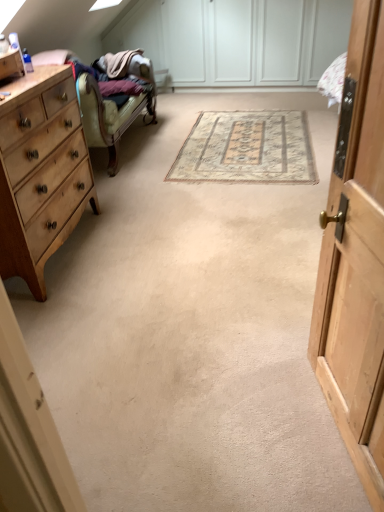
What do you see at coordinates (247, 149) in the screenshot? The height and width of the screenshot is (512, 384). I see `beige woven rug at center` at bounding box center [247, 149].

Locate an element on the screen. This screenshot has width=384, height=512. wooden cabinet at right is located at coordinates (356, 259).

Measure the distance between wooden cabinet at right and light wood/finish chest of drawers at left.

wooden cabinet at right and light wood/finish chest of drawers at left are 4.91 feet apart.

From a real-world perspective, who is located lower, wooden cabinet at right or light wood/finish chest of drawers at left?

light wood/finish chest of drawers at left is physically lower.

From the image's perspective, which one is positioned lower, wooden cabinet at right or light wood/finish chest of drawers at left?

wooden cabinet at right appears lower in the image.

How different are the orientations of wooden cabinet at right and light wood/finish chest of drawers at left in degrees?

They differ by 169 degrees in their facing directions.

From the image's perspective, does beige woven rug at center appear lower than wooden cabinet at right?

No, from the image's perspective, beige woven rug at center is not beneath wooden cabinet at right.

In terms of height, does beige woven rug at center look taller or shorter compared to wooden cabinet at right?

beige woven rug at center is shorter than wooden cabinet at right.

Consider the image. From a real-world perspective, relative to wooden cabinet at right, is beige woven rug at center vertically above or below?

beige woven rug at center is below wooden cabinet at right.

Considering the sizes of beige woven rug at center and wooden cabinet at right in the image, is beige woven rug at center bigger or smaller than wooden cabinet at right?

Clearly, beige woven rug at center is smaller in size than wooden cabinet at right.

Choose the correct answer: Is light wood/finish chest of drawers at left inside beige woven rug at center or outside it?

light wood/finish chest of drawers at left exists outside the volume of beige woven rug at center.

From a real-world perspective, is light wood/finish chest of drawers at left beneath beige woven rug at center?

Incorrect, from a real-world perspective, light wood/finish chest of drawers at left is higher than beige woven rug at center.

From the image's perspective, between light wood/finish chest of drawers at left and beige woven rug at center, which one is located above?

beige woven rug at center appears higher in the image.

Is wooden cabinet at right turned away from beige woven rug at center?

wooden cabinet at right does not have its back to beige woven rug at center.

Does wooden cabinet at right appear on the right side of beige woven rug at center?

No.

Image resolution: width=384 pixels, height=512 pixels. I want to click on cabinetry in front of the beige woven rug at center, so click(356, 259).

Is wooden cabinet at right placed right next to beige woven rug at center?

No.

Is beige woven rug at center completely or partially outside of light wood/finish chest of drawers at left?

Yes, beige woven rug at center is located beyond the bounds of light wood/finish chest of drawers at left.

From a real-world perspective, is beige woven rug at center physically located above or below light wood/finish chest of drawers at left?

Clearly, from a real-world perspective, beige woven rug at center is below light wood/finish chest of drawers at left.

Where is `the chest of drawers above the beige woven rug at center (from a real-world perspective)`? This screenshot has height=512, width=384. the chest of drawers above the beige woven rug at center (from a real-world perspective) is located at coordinates (41, 173).

Can you confirm if beige woven rug at center is bigger than light wood/finish chest of drawers at left?

Incorrect, beige woven rug at center is not larger than light wood/finish chest of drawers at left.

In terms of width, does light wood/finish chest of drawers at left look wider or thinner when compared to wooden cabinet at right?

Clearly, light wood/finish chest of drawers at left has more width compared to wooden cabinet at right.

From a real-world perspective, which is physically above, light wood/finish chest of drawers at left or wooden cabinet at right?

wooden cabinet at right, from a real-world perspective.

Can you confirm if light wood/finish chest of drawers at left is taller than wooden cabinet at right?

No, light wood/finish chest of drawers at left is not taller than wooden cabinet at right.

You are a GUI agent. You are given a task and a screenshot of the screen. Output one action in this format:
    pyautogui.click(x=<x>, y=<y>)
    Task: Click on the chest of drawers on the left of wooden cabinet at right
    
    Given the screenshot: What is the action you would take?
    pyautogui.click(x=41, y=173)

Image resolution: width=384 pixels, height=512 pixels. What are the coordinates of `cabinetry above the beige woven rug at center (from a real-world perspective)` in the screenshot? It's located at (356, 259).

From the image, which object appears to be farther from light wood/finish chest of drawers at left, wooden cabinet at right or beige woven rug at center?

wooden cabinet at right lies further to light wood/finish chest of drawers at left than the other object.

From the image, which object appears to be nearer to beige woven rug at center, light wood/finish chest of drawers at left or wooden cabinet at right?

light wood/finish chest of drawers at left is positioned closer to the anchor beige woven rug at center.

Estimate the real-world distances between objects in this image. Which object is further from wooden cabinet at right, beige woven rug at center or light wood/finish chest of drawers at left?

The object further to wooden cabinet at right is beige woven rug at center.

From the image, which object appears to be farther from wooden cabinet at right, light wood/finish chest of drawers at left or beige woven rug at center?

The object further to wooden cabinet at right is beige woven rug at center.

Estimate the real-world distances between objects in this image. Which object is closer to beige woven rug at center, wooden cabinet at right or light wood/finish chest of drawers at left?

light wood/finish chest of drawers at left is positioned closer to the anchor beige woven rug at center.

Looking at the image, which one is located closer to light wood/finish chest of drawers at left, beige woven rug at center or wooden cabinet at right?

beige woven rug at center is closer to light wood/finish chest of drawers at left.

This screenshot has height=512, width=384. What are the coordinates of `the chest of drawers located between wooden cabinet at right and beige woven rug at center in the depth direction` in the screenshot? It's located at (41, 173).